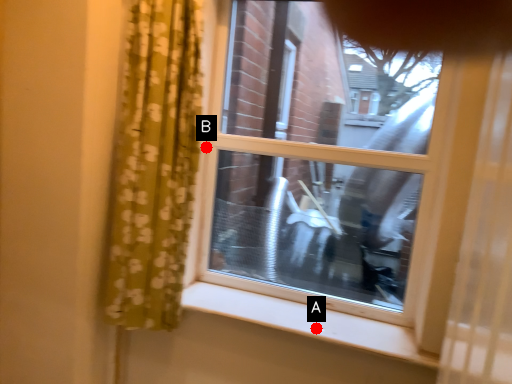
Question: Two points are circled on the image, labeled by A and B beside each circle. Among these points, which one is nearest to the camera?

Choices:
 (A) A is closer
 (B) B is closer

Answer: (A)